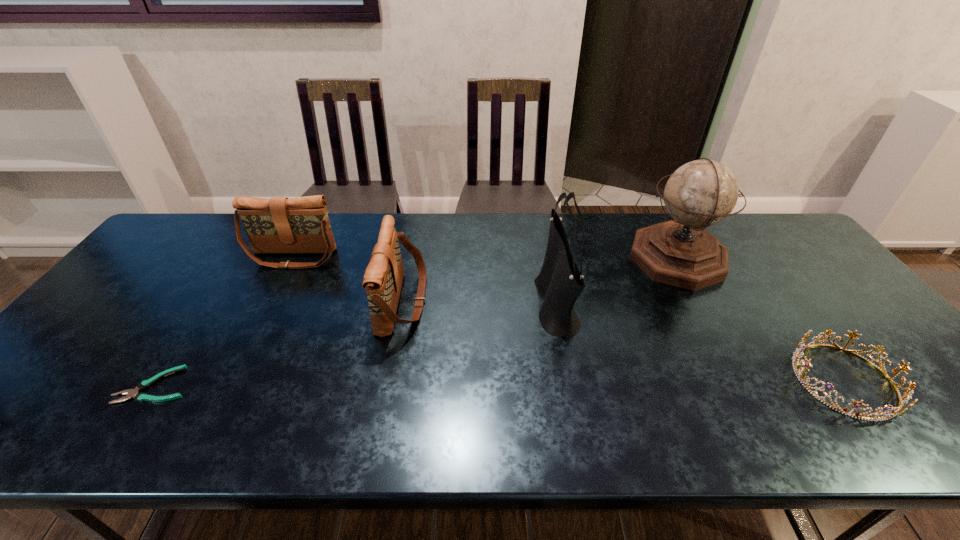
Identify the location of object situated at the right edge. This screenshot has height=540, width=960. (907, 395).

Find the location of a particular element. This screenshot has height=540, width=960. object present at the near right corner is located at coordinates (907, 395).

The height and width of the screenshot is (540, 960). Find the location of `free space at the far edge of the desktop`. free space at the far edge of the desktop is located at coordinates (245, 240).

Locate an element on the screen. The width and height of the screenshot is (960, 540). free space at the near edge of the desktop is located at coordinates (708, 429).

Where is `vacant space at the left edge of the desktop`? This screenshot has width=960, height=540. vacant space at the left edge of the desktop is located at coordinates (31, 400).

Where is `free location at the right edge`? This screenshot has height=540, width=960. free location at the right edge is located at coordinates (822, 269).

In the image, there is a desktop. Where is `blank space at the far right corner`? The height and width of the screenshot is (540, 960). blank space at the far right corner is located at coordinates (793, 254).

Find the location of `vacant space at the near right corner of the desktop`. vacant space at the near right corner of the desktop is located at coordinates (949, 431).

This screenshot has width=960, height=540. Find the location of `free space between the shortest object and the second shortest object`. free space between the shortest object and the second shortest object is located at coordinates (499, 383).

Image resolution: width=960 pixels, height=540 pixels. In order to click on free point between the globe and the second shortest object in this screenshot , I will do `click(760, 319)`.